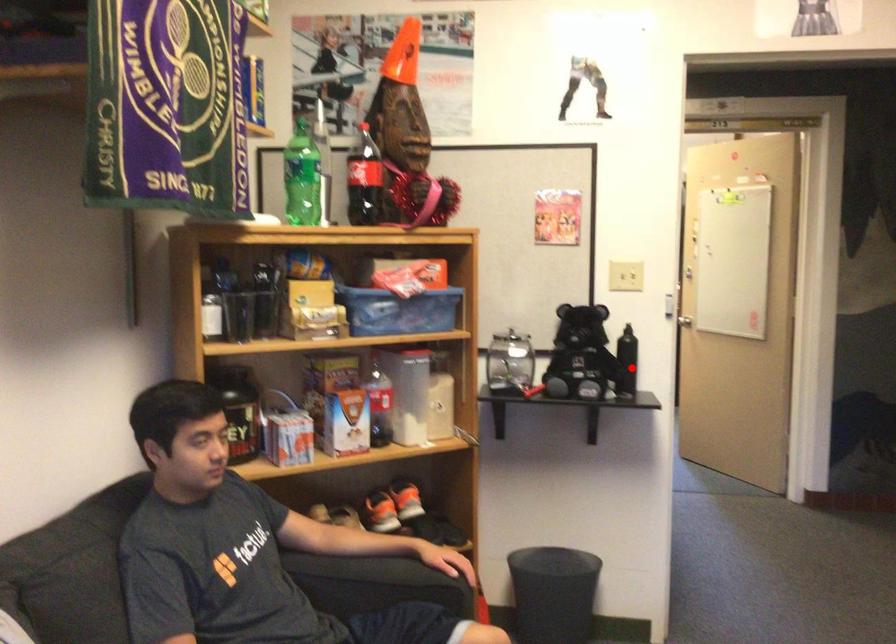
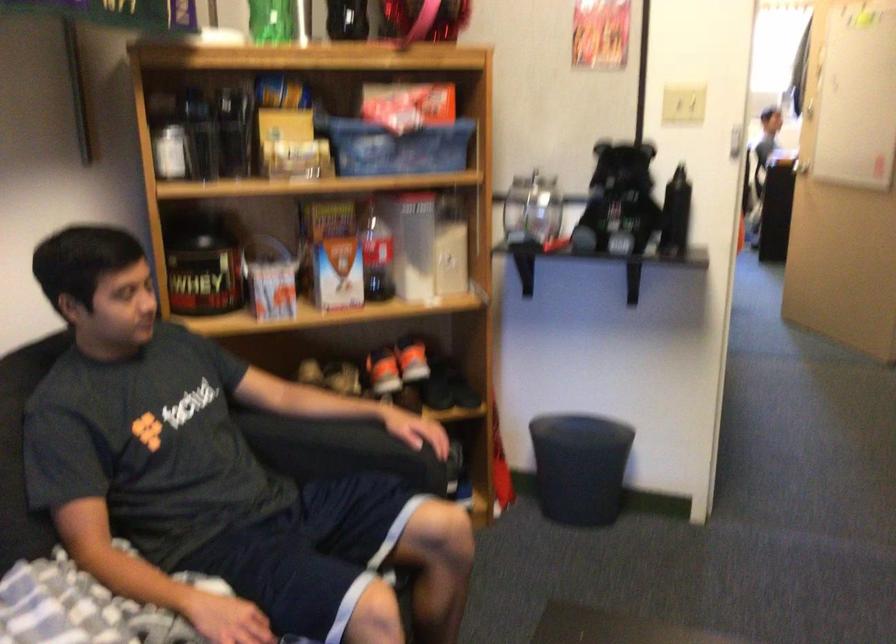
Question: A red point is marked in image1. In image2, is the corresponding 3D point closer to the camera or farther? Reply with the corresponding letter.

Choices:
 (A) The corresponding 3D point is closer.
 (B) The corresponding 3D point is farther.

Answer: (A)